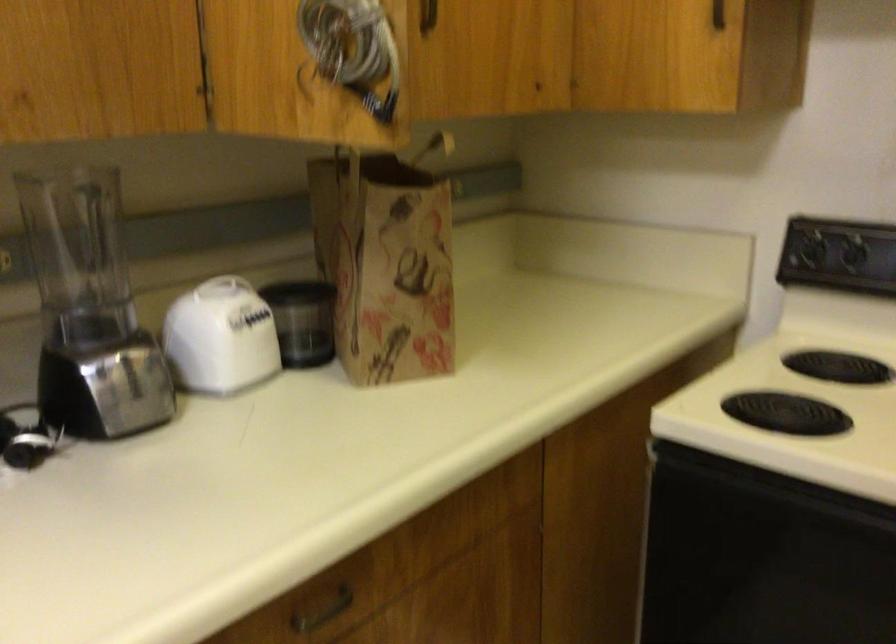
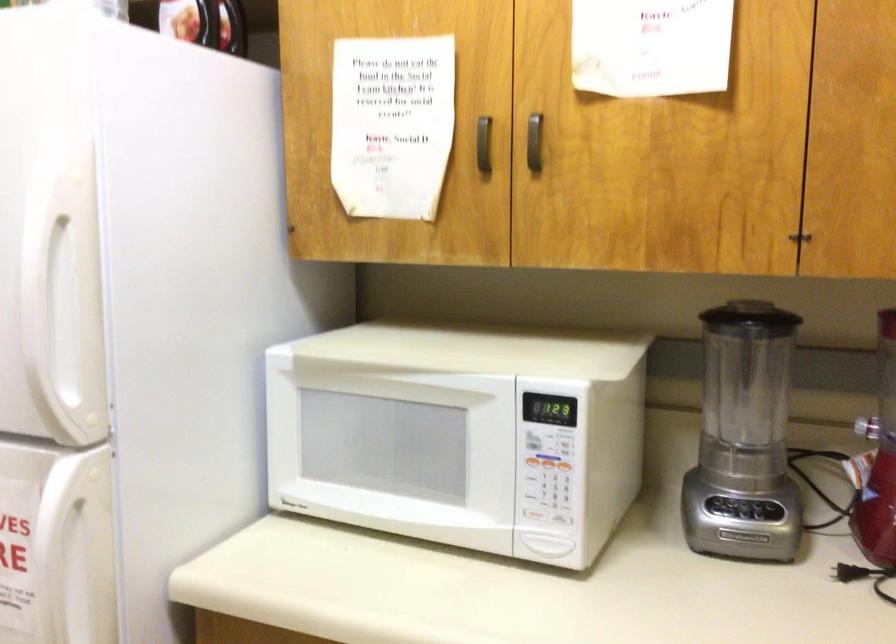
Question: The first image is from the beginning of the video and the second image is from the end. How did the camera likely rotate when shooting the video?

Choices:
 (A) Left
 (B) Right
 (C) Up
 (D) Down

Answer: (A)